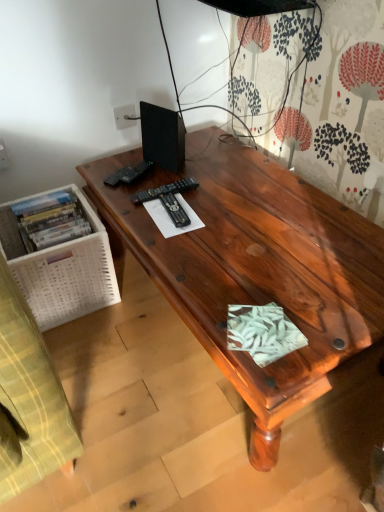
Find the location of a particular element. The width and height of the screenshot is (384, 512). vacant area that lies in front of black matte speaker at upper left is located at coordinates (167, 184).